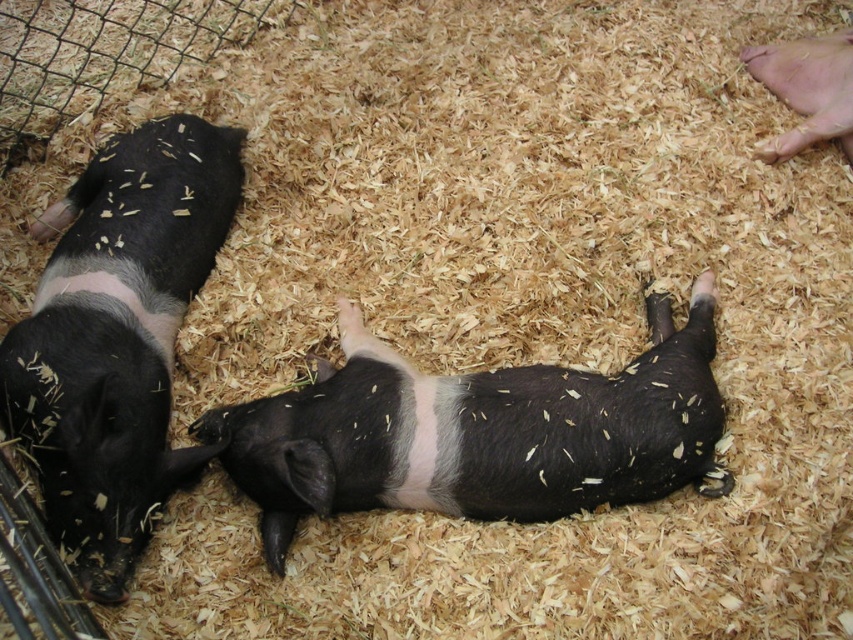
Which of these two, black matte pig at center or black matte pig at left, stands shorter?

With less height is black matte pig at center.

Is black matte pig at center shorter than black matte pig at left?

Indeed, black matte pig at center has a lesser height compared to black matte pig at left.

This screenshot has width=853, height=640. I want to click on black matte pig at center, so click(479, 433).

Where is `black matte pig at center`? The height and width of the screenshot is (640, 853). black matte pig at center is located at coordinates (479, 433).

Can you confirm if black matte pig at center is wider than black matte pig at upper right?

Indeed, black matte pig at center has a greater width compared to black matte pig at upper right.

Is point (628, 440) positioned in front of point (844, 49)?

Yes, it is.

Is point (279, 532) behind point (809, 72)?

No, it is in front of (809, 72).

Locate an element on the screen. The height and width of the screenshot is (640, 853). black matte pig at center is located at coordinates (479, 433).

Which of these two, black matte pig at left or black matte pig at upper right, stands shorter?

black matte pig at upper right

What do you see at coordinates (117, 337) in the screenshot? I see `black matte pig at left` at bounding box center [117, 337].

This screenshot has width=853, height=640. I want to click on black matte pig at left, so click(117, 337).